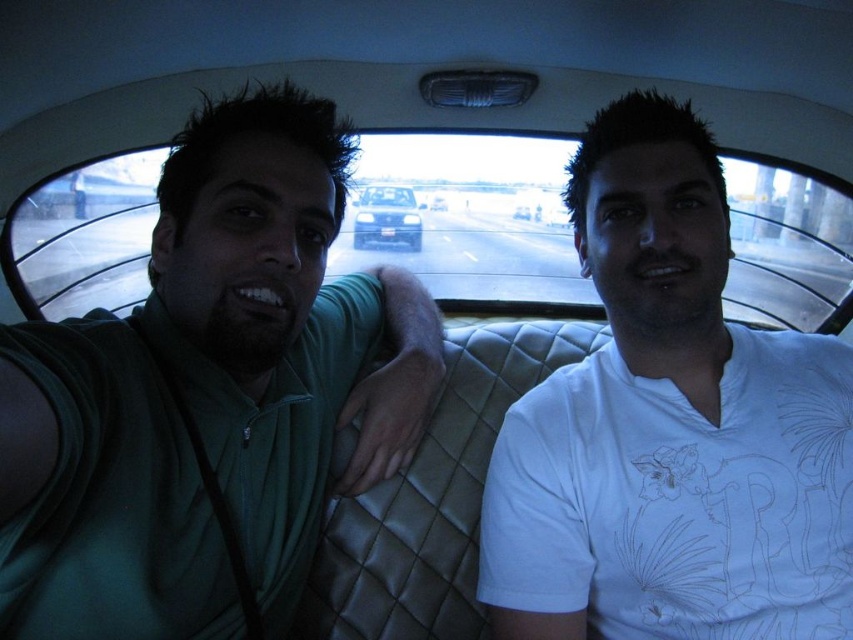
Identify the location of green fabric shirt at left. (207, 396).

What do you see at coordinates (207, 396) in the screenshot?
I see `green fabric shirt at left` at bounding box center [207, 396].

The width and height of the screenshot is (853, 640). What are the coordinates of `green fabric shirt at left` in the screenshot? It's located at (207, 396).

Is point (485, 515) farther from camera compared to point (444, 205)?

No, (485, 515) is closer to viewer.

Is point (555, 467) closer to viewer compared to point (445, 209)?

That is True.

Identify the location of white matte shirt at right. point(670,428).

Measure the distance between green fabric shirt at left and white matte shirt at right.

The distance of green fabric shirt at left from white matte shirt at right is 35.55 centimeters.

Is green fabric shirt at left taller than white matte shirt at right?

Yes.

Find the location of a particular element. This screenshot has width=853, height=640. green fabric shirt at left is located at coordinates (207, 396).

Image resolution: width=853 pixels, height=640 pixels. In order to click on green fabric shirt at left in this screenshot , I will do `click(207, 396)`.